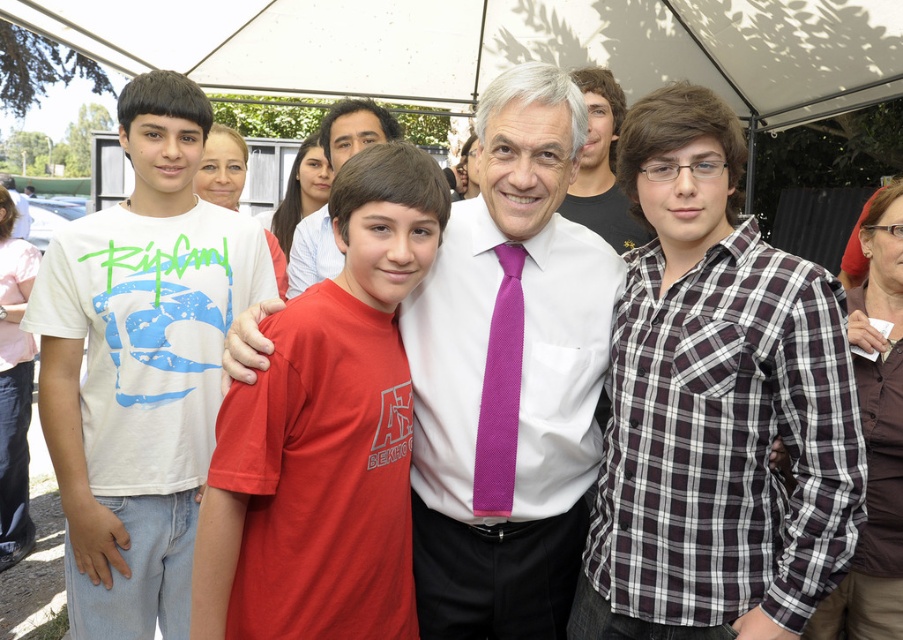
Question: Can you confirm if white smooth shirt at center is positioned above white matte t-shirt at left?

Choices:
 (A) yes
 (B) no

Answer: (B)

Question: Which object appears farthest from the camera in this image?

Choices:
 (A) red cotton t-shirt at center
 (B) plaid cotton shirt at center
 (C) white smooth shirt at center
 (D) white matte t-shirt at left

Answer: (D)

Question: Which object is farther from the camera taking this photo?

Choices:
 (A) white matte t-shirt at left
 (B) purple textured tie at center
 (C) plaid cotton shirt at center

Answer: (A)

Question: Which point appears closest to the camera in this image?

Choices:
 (A) (628, 353)
 (B) (531, 234)
 (C) (499, 337)
 (D) (202, 634)

Answer: (D)

Question: Can you confirm if white smooth shirt at center is positioned to the right of white matte t-shirt at left?

Choices:
 (A) no
 (B) yes

Answer: (B)

Question: Where is white matte t-shirt at left located in relation to white fabric canopy at upper center in the image?

Choices:
 (A) above
 (B) below

Answer: (B)